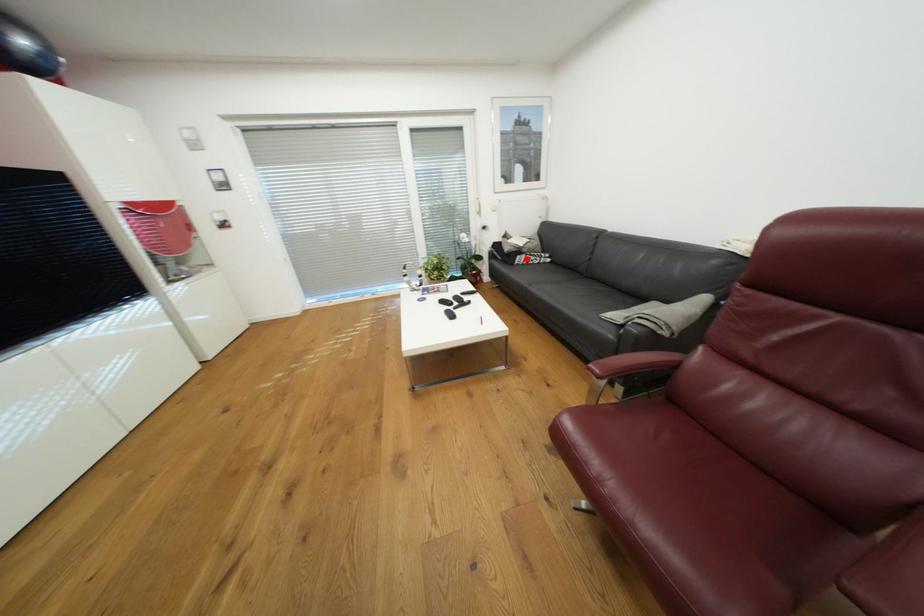
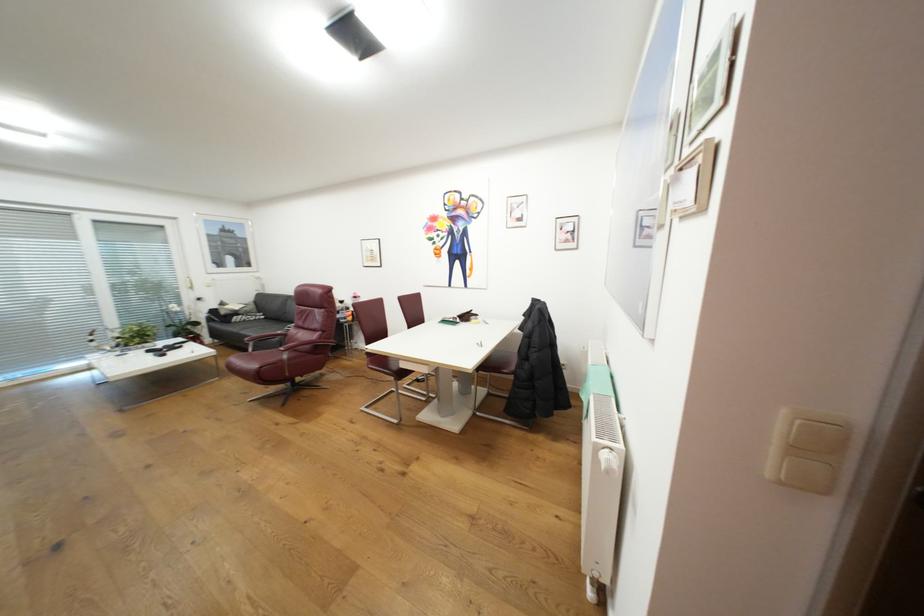
Question: I am providing you with two images of the same scene from different viewpoints. A red point is shown in image1. For the corresponding object point in image2, is it positioned nearer or farther from the camera?

Choices:
 (A) Nearer
 (B) Farther

Answer: (B)